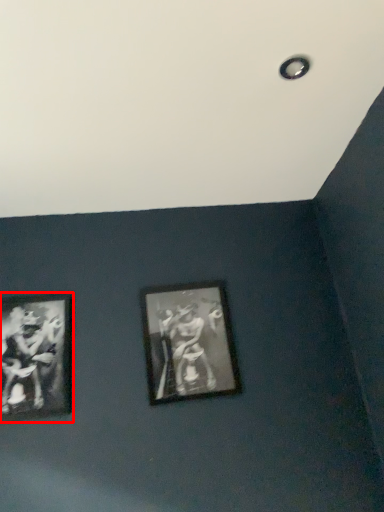
Question: Observing the image, what is the correct spatial positioning of picture frame (annotated by the red box) in reference to picture frame?

Choices:
 (A) left
 (B) right

Answer: (A)